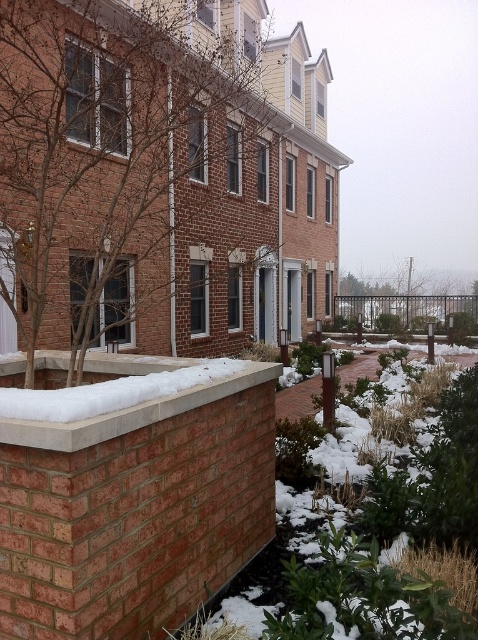
Is brown leafless tree at upper left smaller than green leafy tree at center?

Yes.

Is brown leafless tree at upper left taller than green leafy tree at center?

Indeed, brown leafless tree at upper left has a greater height compared to green leafy tree at center.

Is point (236, 240) less distant than point (358, 280)?

Yes, it is.

What are the coordinates of `brown leafless tree at upper left` in the screenshot? It's located at (115, 160).

Between point (185, 76) and point (195, 358), which one is positioned in front?

Point (195, 358) is more forward.

Does brown leafless tree at upper left have a lesser height compared to concrete at center?

No, brown leafless tree at upper left is not shorter than concrete at center.

Is point (172, 273) farther from camera compared to point (44, 416)?

Yes, it is.

Identify the location of brown leafless tree at upper left. (115, 160).

Where is `concrete at center`? concrete at center is located at coordinates (116, 408).

Who is more distant from viewer, (152, 406) or (345, 321)?

The point (345, 321) is more distant.

Between point (32, 429) and point (422, 326), which one is positioned behind?

The point (422, 326) is more distant.

Identify the location of concrete at center. Image resolution: width=478 pixels, height=640 pixels. (116, 408).